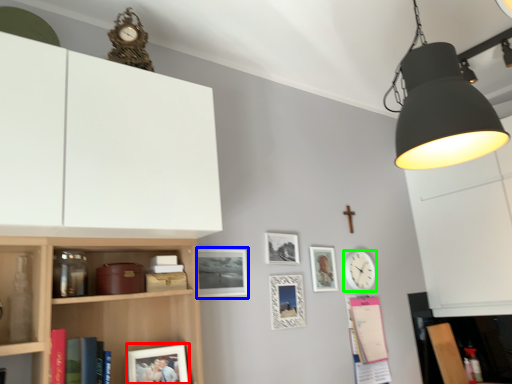
Question: Estimate the real-world distances between objects in this image. Which object is farther from picture frame (highlighted by a red box), picture frame (highlighted by a blue box) or clock (highlighted by a green box)?

Choices:
 (A) picture frame
 (B) clock

Answer: (B)